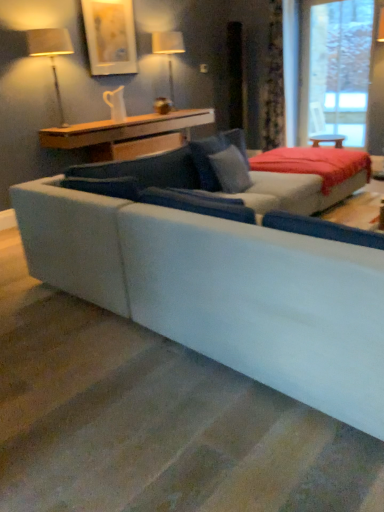
Question: Considering the relative sizes of suede gray couch at center and wooden table at upper center in the image provided, is suede gray couch at center bigger than wooden table at upper center?

Choices:
 (A) no
 (B) yes

Answer: (B)

Question: Can you confirm if suede gray couch at center is smaller than wooden table at upper center?

Choices:
 (A) no
 (B) yes

Answer: (A)

Question: Can you confirm if suede gray couch at center is positioned to the left of wooden table at upper center?

Choices:
 (A) yes
 (B) no

Answer: (B)

Question: From a real-world perspective, is suede gray couch at center under wooden table at upper center?

Choices:
 (A) no
 (B) yes

Answer: (B)

Question: Is suede gray couch at center facing away from wooden table at upper center?

Choices:
 (A) no
 (B) yes

Answer: (A)

Question: Does suede gray couch at center have a greater height compared to wooden table at upper center?

Choices:
 (A) no
 (B) yes

Answer: (B)

Question: Is matte gold picture frame at upper center further to the viewer compared to white fabric lampshade at upper center, acting as the first table lamp starting from the back?

Choices:
 (A) no
 (B) yes

Answer: (A)

Question: Is matte gold picture frame at upper center completely or partially outside of white fabric lampshade at upper center, which is the 2th table lamp in left-to-right order?

Choices:
 (A) no
 (B) yes

Answer: (B)

Question: From the image's perspective, is matte gold picture frame at upper center under white fabric lampshade at upper center, which ranks as the 1th table lamp in right-to-left order?

Choices:
 (A) no
 (B) yes

Answer: (A)

Question: Is matte gold picture frame at upper center beside white fabric lampshade at upper center, acting as the first table lamp starting from the back?

Choices:
 (A) yes
 (B) no

Answer: (B)

Question: Is matte gold picture frame at upper center turned away from white fabric lampshade at upper center, which ranks as the 1th table lamp in right-to-left order?

Choices:
 (A) no
 (B) yes

Answer: (A)

Question: Does matte gold picture frame at upper center have a lesser width compared to white fabric lampshade at upper center, acting as the first table lamp starting from the back?

Choices:
 (A) yes
 (B) no

Answer: (A)

Question: Is there a large distance between suede blue pillow at center and velvet floral curtain at upper right?

Choices:
 (A) yes
 (B) no

Answer: (A)